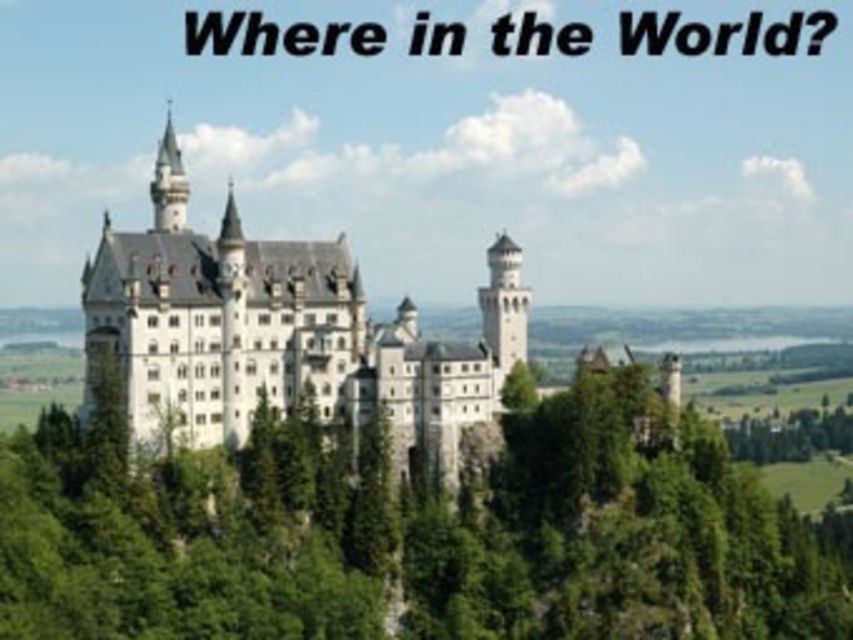
Is green leafy tree at center to the left of white stone castle at center from the viewer's perspective?

In fact, green leafy tree at center is to the right of white stone castle at center.

Is point (112, 419) behind point (134, 364)?

No, (112, 419) is closer to viewer.

Is point (635, 547) closer to camera compared to point (457, 428)?

Yes, point (635, 547) is in front of point (457, 428).

I want to click on green leafy tree at center, so click(412, 532).